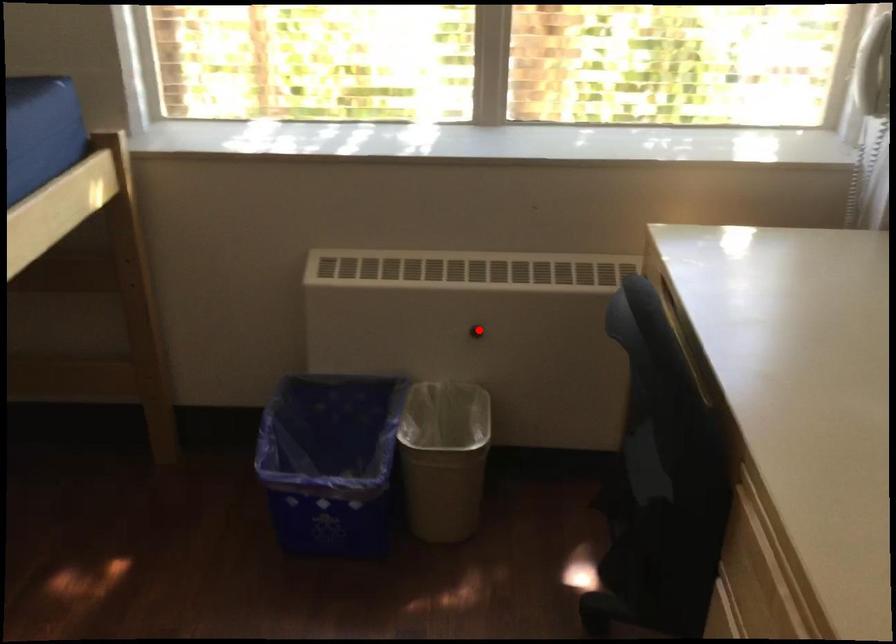
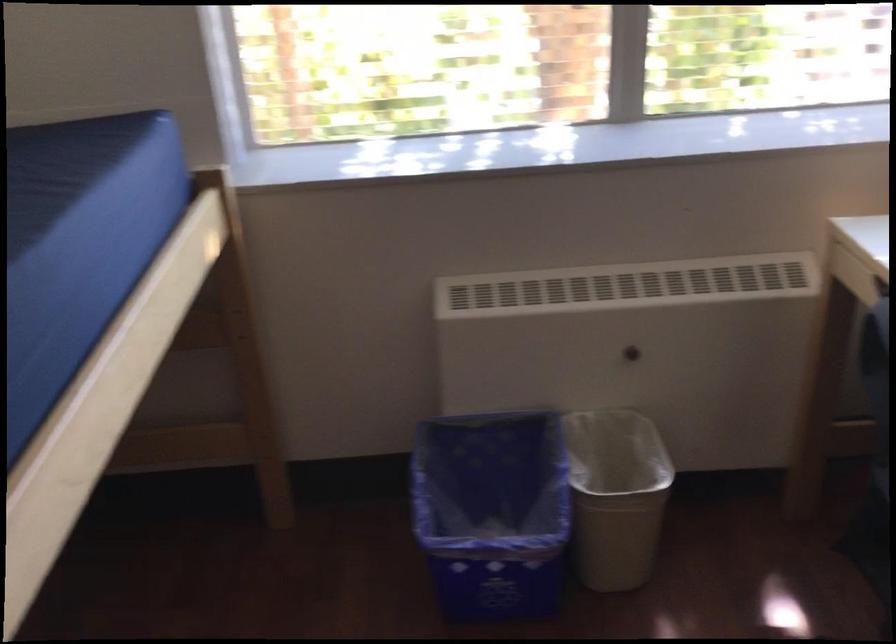
Question: I am providing you with two images of the same scene from different viewpoints. In image1, a red point is highlighted. Considering the same 3D point in image2, which of the following is correct?

Choices:
 (A) It is closer
 (B) It is farther

Answer: (A)